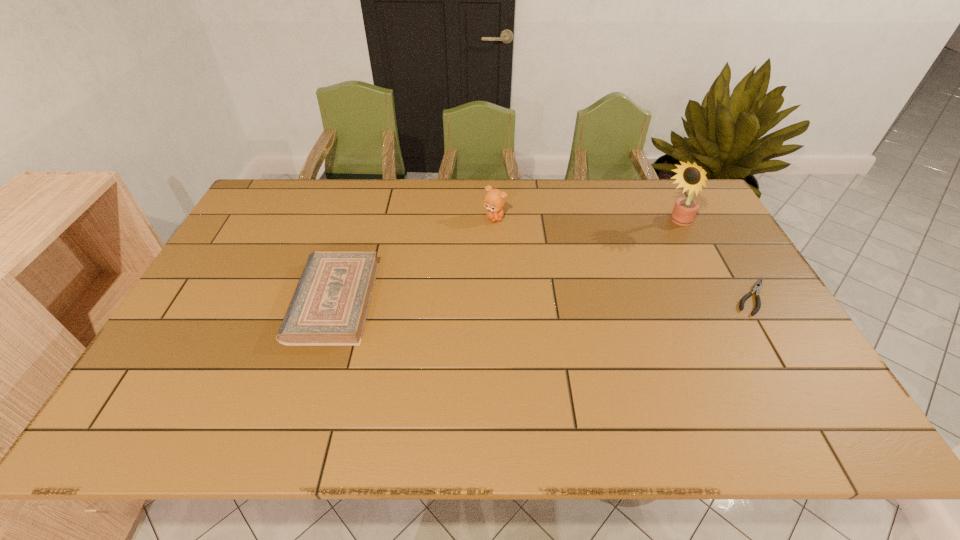
Identify the location of Bible. (330, 304).

This screenshot has width=960, height=540. In order to click on the leftmost object in this screenshot , I will do `click(330, 304)`.

What are the coordinates of `the shortest object` in the screenshot? It's located at (757, 286).

At what (x,y) coordinates should I click in order to perform the action: click on sunflower. Please return your answer as a coordinate pair (x, y). This screenshot has width=960, height=540. Looking at the image, I should click on (692, 177).

The height and width of the screenshot is (540, 960). I want to click on teddy bear, so click(494, 200).

Locate an element on the screen. The image size is (960, 540). the second tallest object is located at coordinates (494, 200).

The image size is (960, 540). Find the location of `vacant point located on the spine side of the Bible`. vacant point located on the spine side of the Bible is located at coordinates (197, 301).

I want to click on free region located on the spine side of the Bible, so click(271, 301).

Identify the location of vacant space located 0.110m on the spine side of the Bible. This screenshot has width=960, height=540. (256, 301).

Find the location of a particular element. Image resolution: width=960 pixels, height=540 pixels. vacant point located 0.340m on the back of the shortest object is located at coordinates (699, 207).